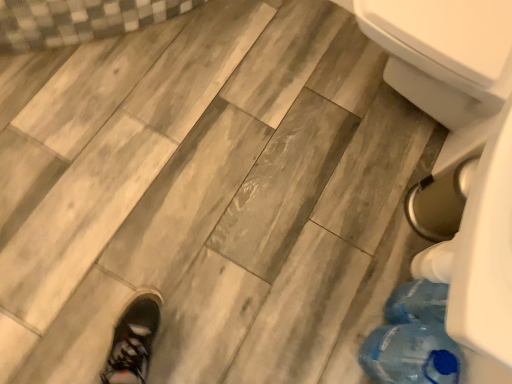
Where is `vacant space in white plastic bidet at lower right (from a real-world perspective)`? vacant space in white plastic bidet at lower right (from a real-world perspective) is located at coordinates [381, 104].